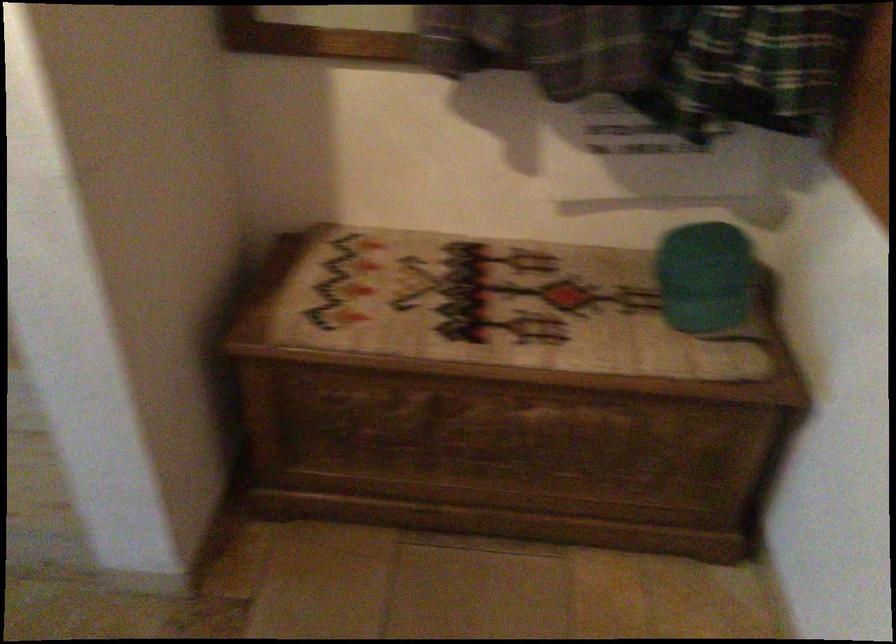
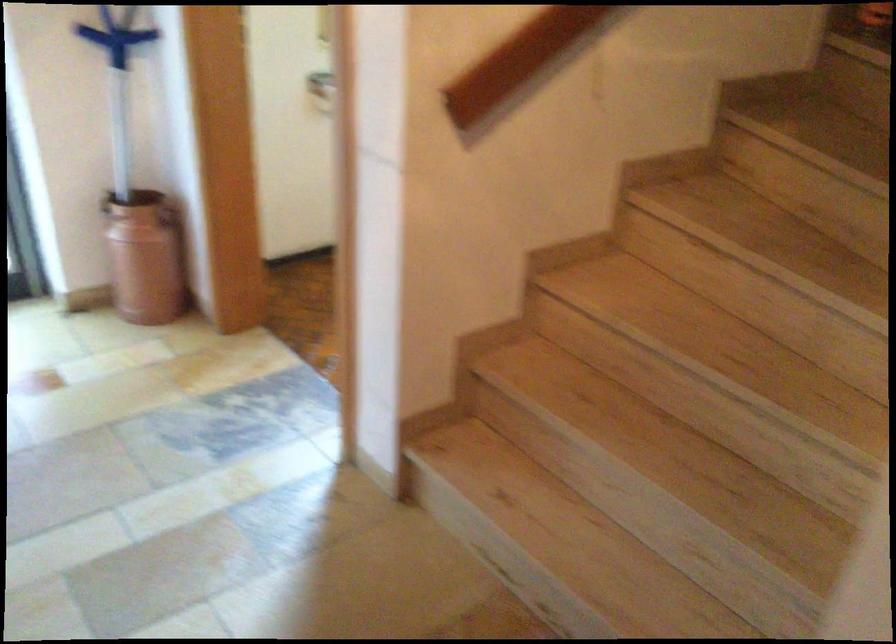
Question: The images are taken continuously from a first-person perspective. In which direction is your viewpoint rotating?

Choices:
 (A) Left
 (B) Right
 (C) Up
 (D) Down

Answer: (A)